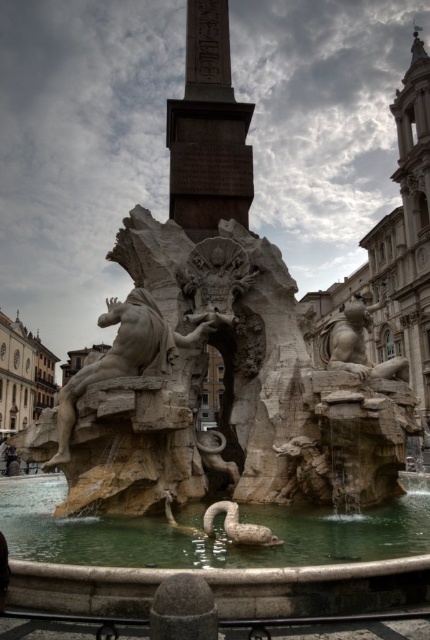
Is green stone water at center bigger than smooth stone lion at right?

No.

Between point (138, 525) and point (381, 369), which one is positioned behind?

The point (381, 369) is more distant.

This screenshot has height=640, width=430. Find the location of `green stone water at center`. green stone water at center is located at coordinates (206, 540).

Who is lower down, green stone water at center or stone statue at center?

green stone water at center is below.

Does point (420, 538) come closer to viewer compared to point (146, 348)?

Yes, it is.

Identify the location of green stone water at center. This screenshot has width=430, height=640. (206, 540).

Is point (49, 461) closer to viewer compared to point (331, 340)?

Yes, it is in front of point (331, 340).

Which is in front, point (172, 360) or point (362, 372)?

Positioned in front is point (362, 372).

Where is `stone statue at center`? This screenshot has height=640, width=430. stone statue at center is located at coordinates (125, 355).